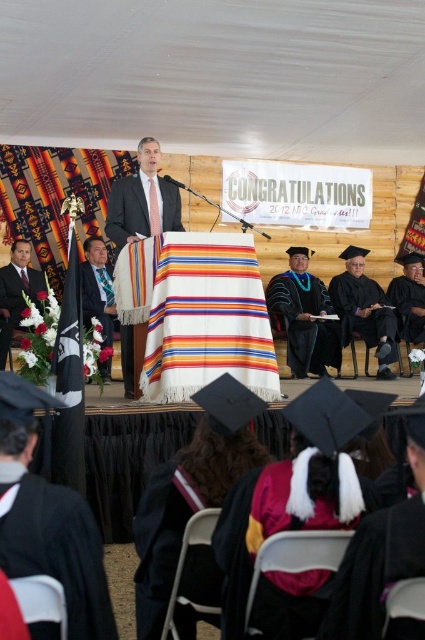
Question: Is black matte graduation gown at lower left below black matte graduation gown at lower right?

Choices:
 (A) yes
 (B) no

Answer: (A)

Question: Can you confirm if velvet burgundy gown at lower center is smaller than black matte graduation gown at center?

Choices:
 (A) no
 (B) yes

Answer: (B)

Question: Is black matte graduation gown at lower left positioned before black matte graduation gown at center?

Choices:
 (A) yes
 (B) no

Answer: (A)

Question: Among these points, which one is nearest to the camera?

Choices:
 (A) (13, 481)
 (B) (6, 307)

Answer: (A)

Question: Which point is closer to the camera taking this photo?

Choices:
 (A) (115, 182)
 (B) (379, 529)

Answer: (B)

Question: Which point is farther to the camera?

Choices:
 (A) (8, 321)
 (B) (345, 560)

Answer: (A)